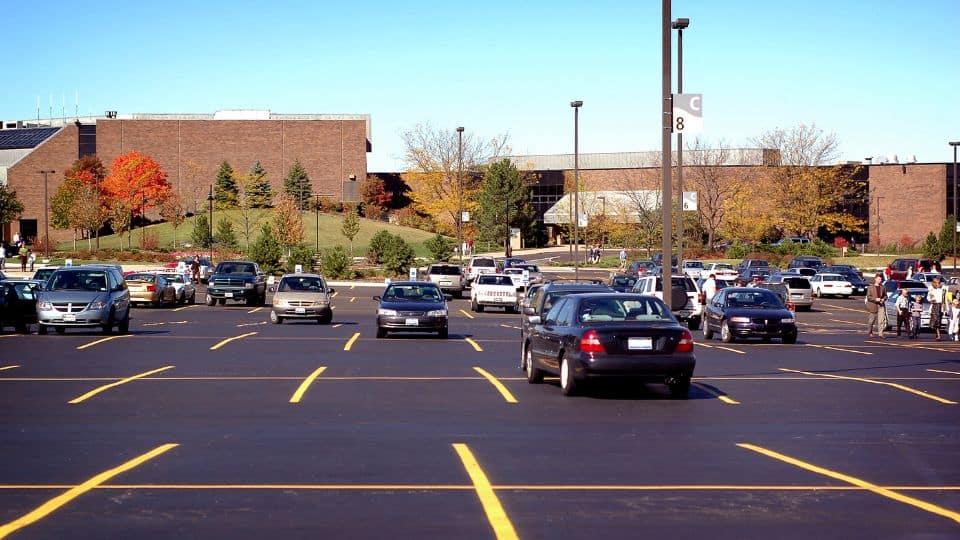
Find the location of a particular element. This screenshot has width=960, height=540. lights is located at coordinates coord(667,29), coord(680,23), coord(577,105), coord(457,126), coord(955,144), coord(46,170).